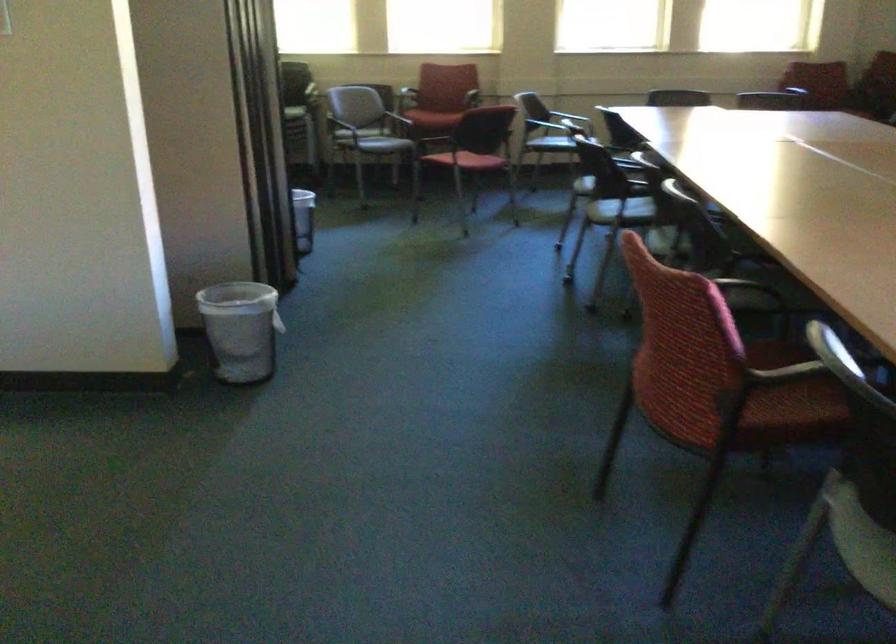
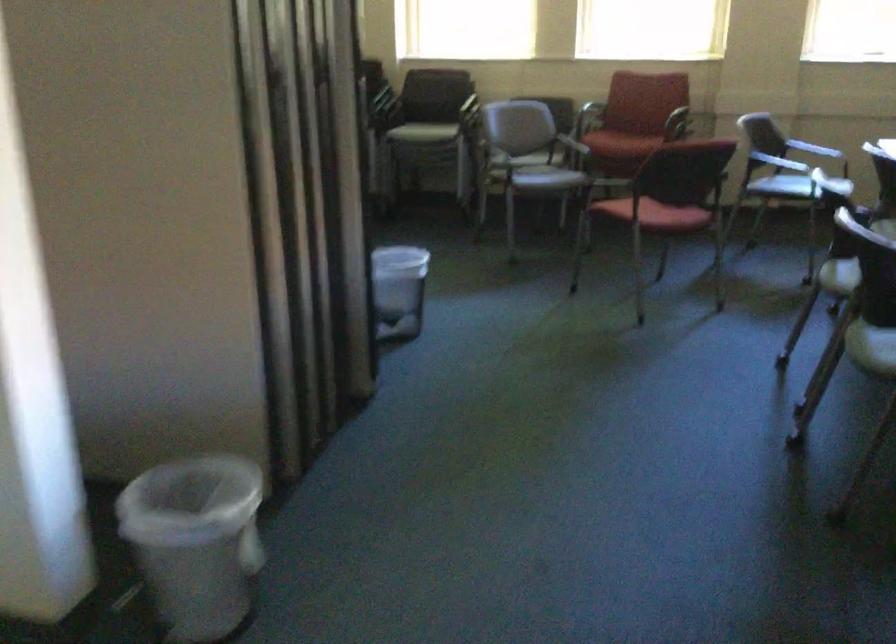
Locate, in the second image, the point that corresponds to pixel 250 317 in the first image.

(195, 542)